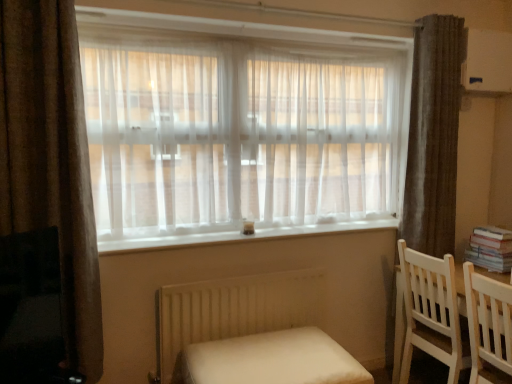
Question: Can you confirm if white fabric bed at lower center is positioned to the left of white matte radiator at lower center?

Choices:
 (A) no
 (B) yes

Answer: (A)

Question: Considering the relative sizes of white fabric bed at lower center and white matte radiator at lower center in the image provided, is white fabric bed at lower center taller than white matte radiator at lower center?

Choices:
 (A) no
 (B) yes

Answer: (A)

Question: Is white fabric bed at lower center bigger than white matte radiator at lower center?

Choices:
 (A) yes
 (B) no

Answer: (A)

Question: Can you confirm if white fabric bed at lower center is smaller than white matte radiator at lower center?

Choices:
 (A) yes
 (B) no

Answer: (B)

Question: From a real-world perspective, is white fabric bed at lower center under white matte radiator at lower center?

Choices:
 (A) yes
 (B) no

Answer: (A)

Question: Based on their positions, is translucent fabric window at center located to the left or right of white matte radiator at lower center?

Choices:
 (A) left
 (B) right

Answer: (B)

Question: In terms of height, does translucent fabric window at center look taller or shorter compared to white matte radiator at lower center?

Choices:
 (A) short
 (B) tall

Answer: (B)

Question: From the image's perspective, is translucent fabric window at center located above or below white matte radiator at lower center?

Choices:
 (A) above
 (B) below

Answer: (A)

Question: Do you think translucent fabric window at center is within white matte radiator at lower center, or outside of it?

Choices:
 (A) inside
 (B) outside

Answer: (B)

Question: Visually, is white matte radiator at lower center positioned to the left or to the right of brown textured curtain at right, arranged as the second curtain when viewed from the left?

Choices:
 (A) left
 (B) right

Answer: (A)

Question: In terms of height, does white matte radiator at lower center look taller or shorter compared to brown textured curtain at right, arranged as the second curtain when viewed from the left?

Choices:
 (A) tall
 (B) short

Answer: (B)

Question: From a real-world perspective, is white matte radiator at lower center positioned above or below brown textured curtain at right, arranged as the second curtain when viewed from the left?

Choices:
 (A) above
 (B) below

Answer: (B)

Question: Considering the positions of white matte radiator at lower center and brown textured curtain at right, arranged as the second curtain when viewed from the left, in the image, is white matte radiator at lower center wider or thinner than brown textured curtain at right, arranged as the second curtain when viewed from the left,?

Choices:
 (A) thin
 (B) wide

Answer: (A)

Question: From their relative heights in the image, would you say brown velvet curtain at left, the first curtain from the left, is taller or shorter than white wooden chair at right, which is the 2th chair in back-to-front order?

Choices:
 (A) tall
 (B) short

Answer: (A)

Question: Is brown velvet curtain at left, which is the 1th curtain from front to back, inside the boundaries of white wooden chair at right, the 1th chair in the front-to-back sequence, or outside?

Choices:
 (A) inside
 (B) outside

Answer: (B)